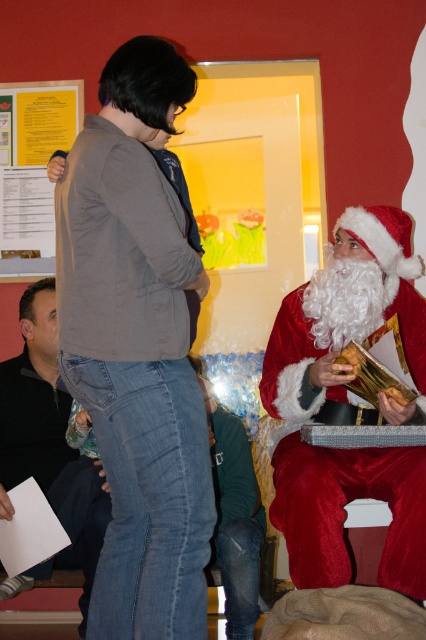
You are organizing a holiday photo shoot and need to ensure that the velvet red santa at right and the yellow paper at upper left fit within the camera frame. Given that the camera has a maximum width capacity of 1 meter, can you confirm if both objects will fit side by side horizontally?

The velvet red santa at right is wider than the yellow paper at upper left. However, without knowing their exact widths or combined total, it is impossible to determine if they will fit within the camera frame. Please measure both objects to ensure their combined width does not exceed 1 meter.

You are a guest at a holiday party and see the velvet red santa at right and the dark gray sweater at lower left. Which one is positioned more to the right side of the scene?

The velvet red santa at right is positioned more to the right side of the scene compared to the dark gray sweater at lower left.